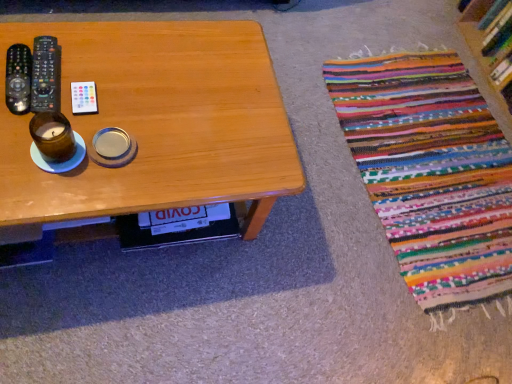
Locate an element on the screen. free space to the back side of black plastic remote control at left, positioned as the 3th remote control in right-to-left order is located at coordinates (69, 43).